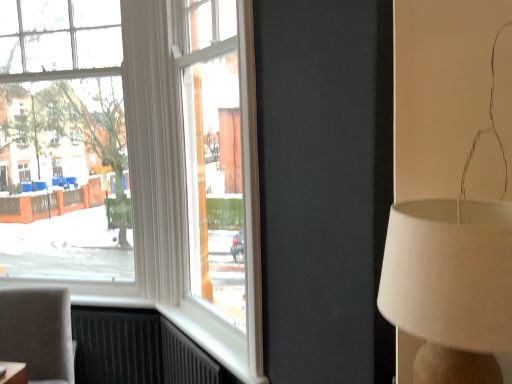
Question: Should I look upward or downward to see white fabric lampshade at right?

Choices:
 (A) down
 (B) up

Answer: (A)

Question: Would you say matte gray chair at lower left is a long distance from clear glass window at left?

Choices:
 (A) no
 (B) yes

Answer: (A)

Question: Does matte gray chair at lower left appear on the right side of clear glass window at left?

Choices:
 (A) yes
 (B) no

Answer: (A)

Question: Does matte gray chair at lower left turn towards clear glass window at left?

Choices:
 (A) yes
 (B) no

Answer: (B)

Question: Is matte gray chair at lower left with clear glass window at left?

Choices:
 (A) yes
 (B) no

Answer: (B)

Question: Is matte gray chair at lower left completely or partially outside of clear glass window at left?

Choices:
 (A) no
 (B) yes

Answer: (B)

Question: Considering the relative sizes of matte gray chair at lower left and clear glass window at left in the image provided, is matte gray chair at lower left taller than clear glass window at left?

Choices:
 (A) yes
 (B) no

Answer: (B)

Question: Are white fabric lampshade at right and matte gray chair at lower left beside each other?

Choices:
 (A) no
 (B) yes

Answer: (A)

Question: Does white fabric lampshade at right have a greater width compared to matte gray chair at lower left?

Choices:
 (A) no
 (B) yes

Answer: (A)

Question: Is white fabric lampshade at right positioned beyond the bounds of matte gray chair at lower left?

Choices:
 (A) yes
 (B) no

Answer: (A)

Question: From a real-world perspective, does white fabric lampshade at right stand above matte gray chair at lower left?

Choices:
 (A) yes
 (B) no

Answer: (A)

Question: From a real-world perspective, does white fabric lampshade at right sit lower than matte gray chair at lower left?

Choices:
 (A) yes
 (B) no

Answer: (B)

Question: Is white fabric lampshade at right positioned far away from matte gray chair at lower left?

Choices:
 (A) no
 (B) yes

Answer: (B)

Question: From a real-world perspective, is clear glass window at left positioned over matte gray chair at lower left based on gravity?

Choices:
 (A) no
 (B) yes

Answer: (B)